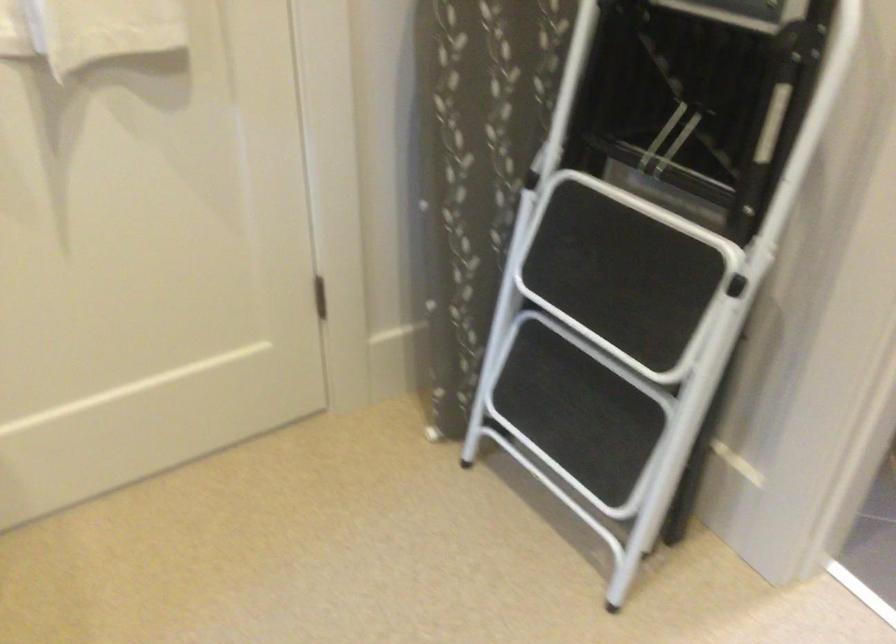
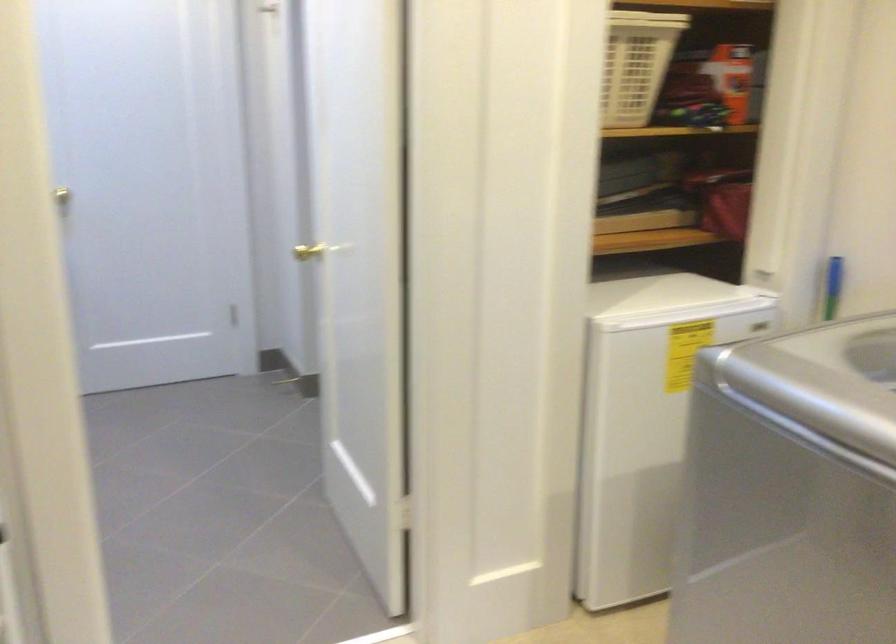
Question: The camera is either moving clockwise (left) or counter-clockwise (right) around the object. The first image is from the beginning of the video and the second image is from the end. Is the camera moving left or right when shooting the video?

Choices:
 (A) Left
 (B) Right

Answer: (A)